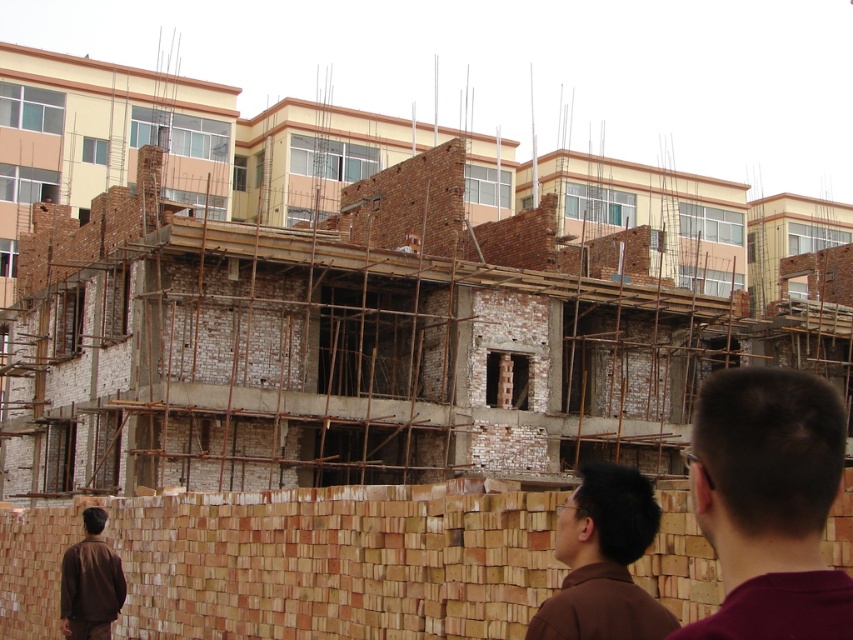
Does brown matte shirt at lower right appear under brown matte shirt at lower left?

No.

Is brown matte shirt at lower right wider than brown matte shirt at lower left?

Yes.

Which is in front, point (648, 502) or point (102, 568)?

Positioned in front is point (648, 502).

Find the location of a particular element. The width and height of the screenshot is (853, 640). brown matte shirt at lower right is located at coordinates (602, 561).

Is brown hair at upper right positioned at the back of brown matte shirt at lower right?

No, brown hair at upper right is closer to the viewer.

This screenshot has height=640, width=853. I want to click on brown hair at upper right, so click(x=769, y=502).

Locate an element on the screen. The image size is (853, 640). brown hair at upper right is located at coordinates (769, 502).

The width and height of the screenshot is (853, 640). In order to click on brown hair at upper right in this screenshot , I will do `click(769, 502)`.

The height and width of the screenshot is (640, 853). Identify the location of brown brick wall at lower center. (299, 563).

Describe the element at coordinates (299, 563) in the screenshot. I see `brown brick wall at lower center` at that location.

This screenshot has width=853, height=640. What are the coordinates of `brown brick wall at lower center` in the screenshot? It's located at (299, 563).